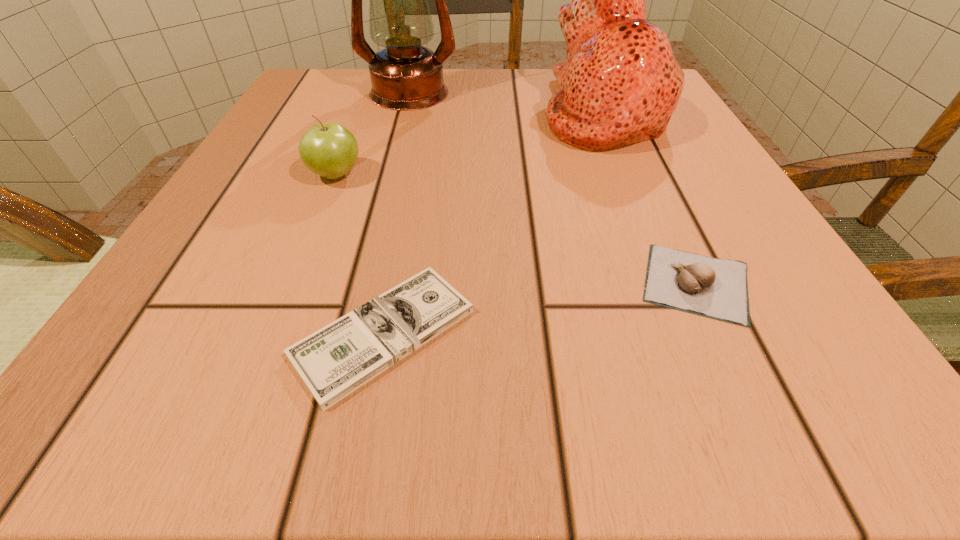
Image resolution: width=960 pixels, height=540 pixels. In order to click on empty location between the tallest object and the garlic in this screenshot , I will do `click(552, 188)`.

The width and height of the screenshot is (960, 540). Identify the location of vacant space in between the apple and the tallest object. (372, 134).

Locate an element on the screen. vacant area that lies between the third nearest object and the dollar is located at coordinates (360, 254).

Find the location of a particular element. The height and width of the screenshot is (540, 960). free space between the second shortest object and the shortest object is located at coordinates (540, 308).

The width and height of the screenshot is (960, 540). In order to click on free point between the cat and the tallest object in this screenshot , I will do `click(506, 102)`.

You are a GUI agent. You are given a task and a screenshot of the screen. Output one action in this format:
    pyautogui.click(x=<x>, y=<y>)
    Task: Click on the vacant space that is in between the cat and the tallest object
    The height and width of the screenshot is (540, 960).
    Given the screenshot: What is the action you would take?
    pyautogui.click(x=506, y=102)

You are a GUI agent. You are given a task and a screenshot of the screen. Output one action in this format:
    pyautogui.click(x=<x>, y=<y>)
    Task: Click on the vacant area that lies between the second shortest object and the shortest object
    The image size is (960, 540).
    Given the screenshot: What is the action you would take?
    pyautogui.click(x=540, y=308)

Identify the location of blank region between the garlic and the third shortest object. (516, 229).

Find the location of `object that ranks as the closest to the cat`. object that ranks as the closest to the cat is located at coordinates (405, 76).

Point out which object is positioned as the nearest to the apple. Please provide its 2D coordinates. Your answer should be formatted as a tuple, i.e. [(x, y)], where the tuple contains the x and y coordinates of a point satisfying the conditions above.

[(336, 360)]